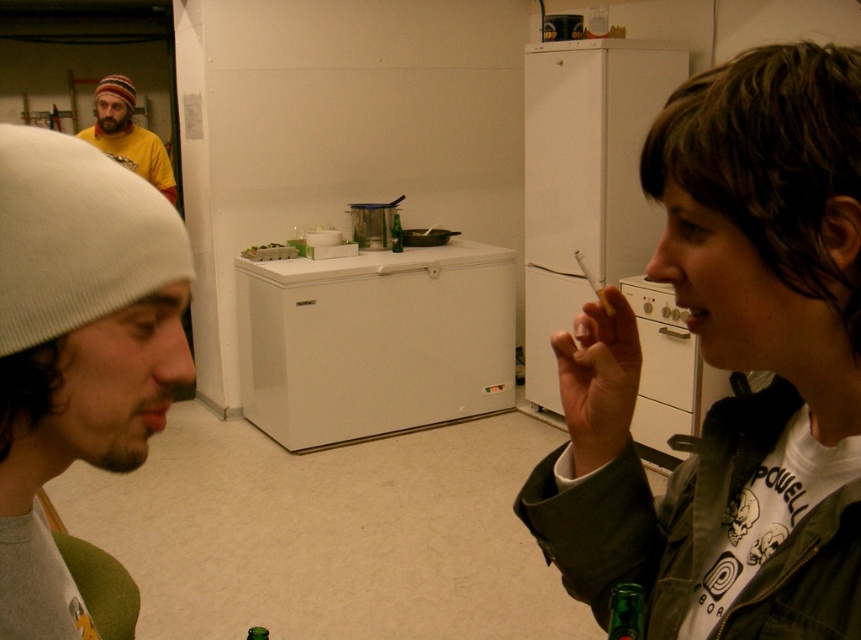
Question: Observing the image, what is the correct spatial positioning of green matte jacket at right in reference to green glass bottle at lower right?

Choices:
 (A) left
 (B) right

Answer: (B)

Question: Which of these objects is positioned closest to the matte yellow shirt at upper left?

Choices:
 (A) green glass bottle at lower right
 (B) white matte refrigerator at upper center

Answer: (B)

Question: Which point is farther to the camera?

Choices:
 (A) (618, 625)
 (B) (29, 618)

Answer: (A)

Question: Is white matte refrigerator at upper center smaller than matte yellow shirt at upper left?

Choices:
 (A) no
 (B) yes

Answer: (A)

Question: Does white knit cap at left appear on the right side of matte yellow shirt at upper left?

Choices:
 (A) no
 (B) yes

Answer: (B)

Question: Which object is positioned farthest from the green matte jacket at right?

Choices:
 (A) matte yellow shirt at upper left
 (B) white matte refrigerator at upper center

Answer: (A)